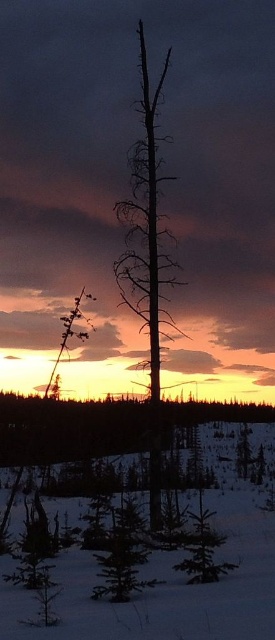
Question: Where is white fluffy snow at center located in relation to silhouette bare tree at center in the image?

Choices:
 (A) above
 (B) below

Answer: (B)

Question: Does white fluffy snow at center have a greater width compared to silhouette bare tree at center?

Choices:
 (A) no
 (B) yes

Answer: (B)

Question: Which point is farther to the camera?

Choices:
 (A) green matte evergreen tree at center
 (B) white fluffy snow at center
 (C) green matte evergreen tree at lower center

Answer: (C)

Question: Based on their relative distances, which object is nearer to the white fluffy snow at center?

Choices:
 (A) green matte evergreen tree at lower center
 (B) green matte evergreen tree at center
 (C) silhouette bare tree at center

Answer: (B)

Question: Does white fluffy snow at center appear under green matte evergreen tree at lower center?

Choices:
 (A) no
 (B) yes

Answer: (B)

Question: Which is nearer to the green matte evergreen tree at lower center?

Choices:
 (A) white fluffy snow at center
 (B) silhouette bare tree at center

Answer: (B)